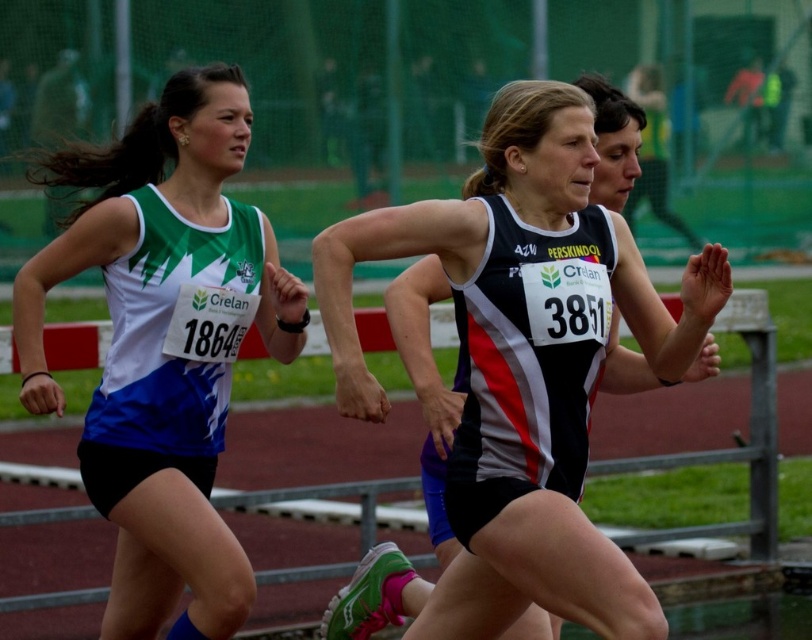
Based on the scene description, which athlete is closer to the finish line? The one wearing the black and white athletic top at center or the matte green and white tank top at left?

The athlete wearing the black and white athletic top at center is leading the race and closer to the finish line as described in the scene.

You are a photographer standing at the starting line of the race. You want to take a photo of the two points in the image labeled as point (413, 253) and point (72, 214). Which point will appear larger in your photo?

Point (413, 253) is closer to the viewer than point (72, 214), so it will appear larger in the photo.